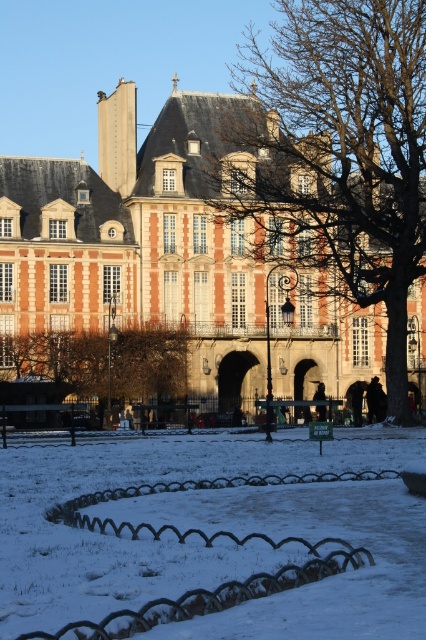
Question: Is matte brick building at center further to camera compared to brown textured tree at center?

Choices:
 (A) yes
 (B) no

Answer: (B)

Question: Which point appears farthest from the camera in this image?

Choices:
 (A) (328, 35)
 (B) (26, 340)

Answer: (A)

Question: Which of the following is the farthest from the observer?

Choices:
 (A) (37, 499)
 (B) (256, 108)
 (C) (164, 340)

Answer: (B)

Question: Which object is positioned closest to the matte brick building at center?

Choices:
 (A) white snow at center
 (B) brown textured tree at center
 (C) bare wood tree at center

Answer: (C)

Question: Can you confirm if bare wood tree at center is bigger than brown textured tree at center?

Choices:
 (A) yes
 (B) no

Answer: (A)

Question: Is matte brick building at center bigger than white snow at center?

Choices:
 (A) yes
 (B) no

Answer: (A)